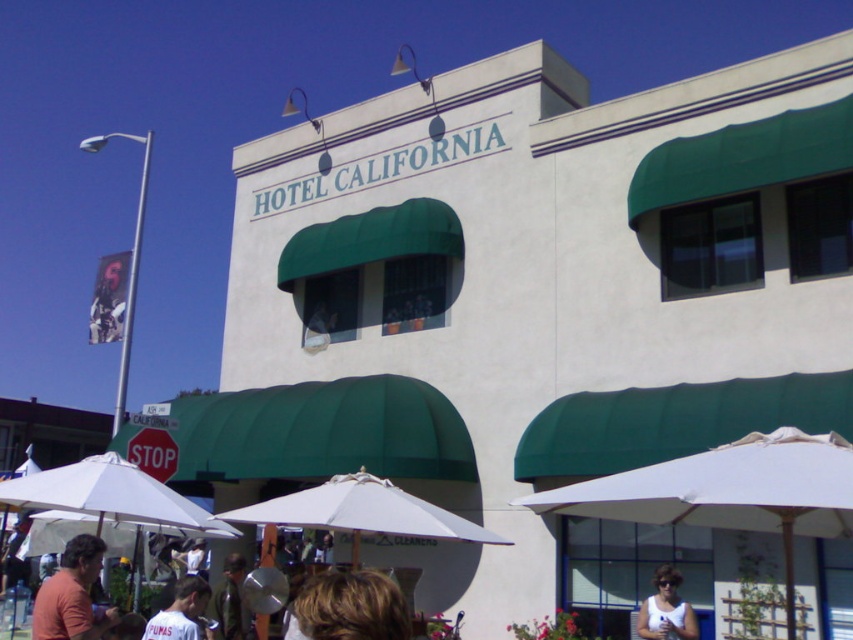
You are a photographer trying to capture a candid shot of the people in front of the HOTEL CALIFORNIA. You notice two individuals wearing white tank top at lower right and white cotton shirt at lower left. Which clothing item is more suitable for a hot summer day?

The white tank top at lower right is thinner than the white cotton shirt at lower left, making it more suitable for a hot summer day as thinner fabrics allow better airflow and cooling.

You are standing in front of the Hotel California and want to take a photo of the blonde hair at lower center and the white cotton shirt at lower left. Which object should you focus on first to ensure both are in clear view?

You should focus on the blonde hair at lower center first because it is closer to the viewer than the white cotton shirt at lower left, ensuring both are in clear view when focused on the closer object.